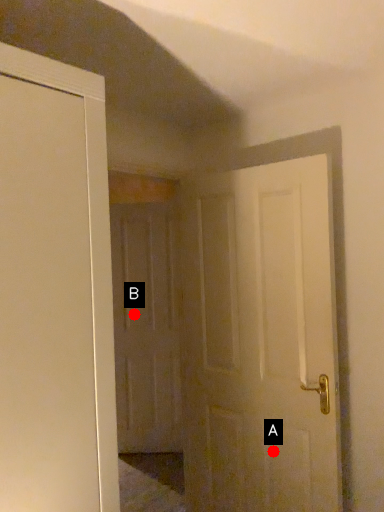
Question: Two points are circled on the image, labeled by A and B beside each circle. Which of the following is the farthest from the observer?

Choices:
 (A) A is further
 (B) B is further

Answer: (B)